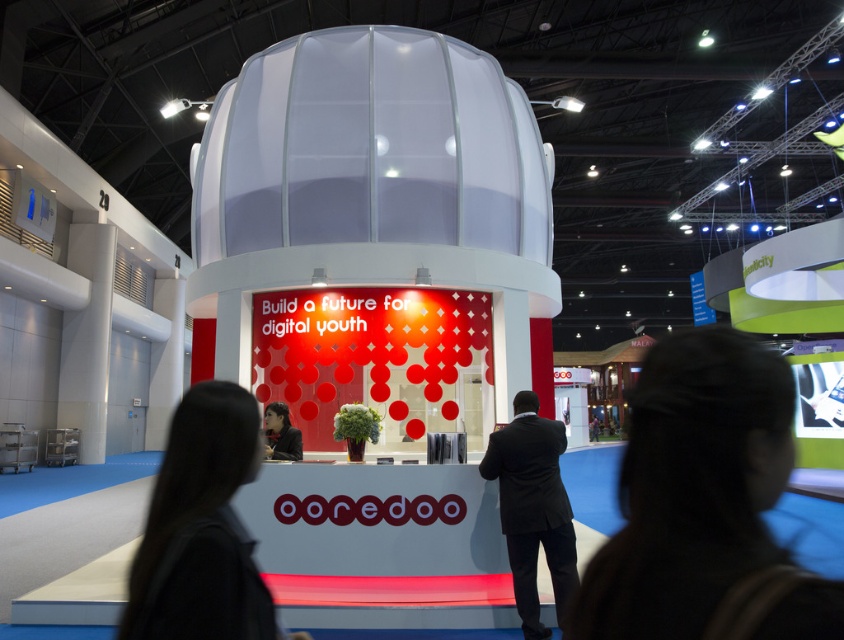
Does matte black laptop at center have a lesser height compared to matte black desk at center?

Correct, matte black laptop at center is not as tall as matte black desk at center.

Based on the photo, who is more forward, [690,419] or [198,476]?

Point [690,419] is in front.

Where is `matte black laptop at center`? This screenshot has height=640, width=844. matte black laptop at center is located at coordinates [x=702, y=502].

Who is positioned more to the left, matte black desk at center or matte black jacket at center?

matte black jacket at center

Does point (247, 550) come in front of point (279, 419)?

Yes, it is in front of point (279, 419).

Locate an element on the screen. matte black desk at center is located at coordinates (199, 529).

Is matte black laptop at center shorter than black suit at center?

Yes.

Is point (842, 614) less distant than point (518, 508)?

Yes.

Find the location of a particular element. matte black laptop at center is located at coordinates (702, 502).